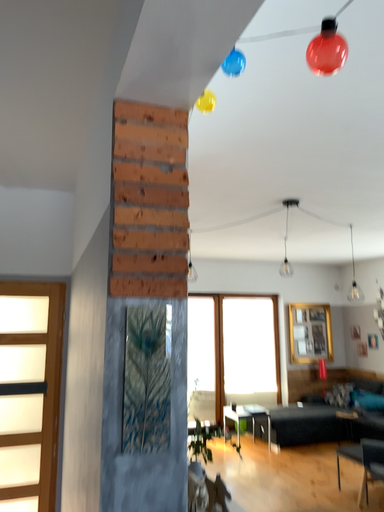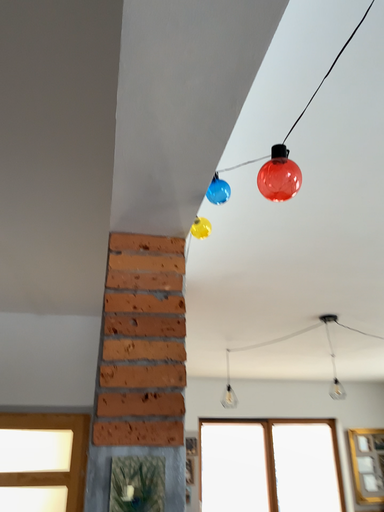
Question: Which way did the camera rotate in the video?

Choices:
 (A) rotated left
 (B) rotated right

Answer: (A)